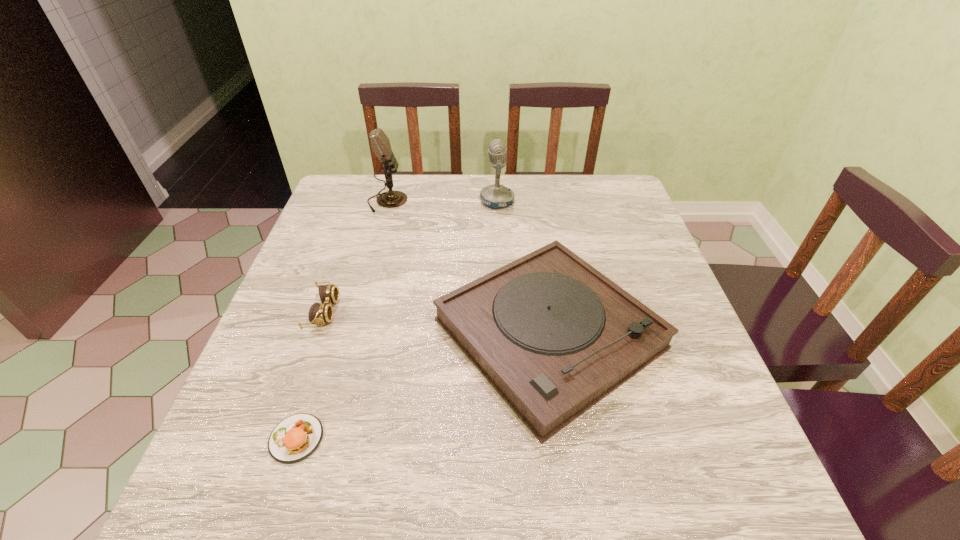
Where is `vacant space at the near edge of the desktop`? The width and height of the screenshot is (960, 540). vacant space at the near edge of the desktop is located at coordinates (403, 490).

This screenshot has width=960, height=540. I want to click on free space at the left edge, so click(x=368, y=245).

You are a GUI agent. You are given a task and a screenshot of the screen. Output one action in this format:
    pyautogui.click(x=<x>, y=<y>)
    Task: Click on the free space at the right edge of the desktop
    This screenshot has height=540, width=960.
    Given the screenshot: What is the action you would take?
    pyautogui.click(x=607, y=232)

I want to click on free region at the far left corner of the desktop, so click(350, 193).

Find the location of a particular element. vacant space at the near left corner of the desktop is located at coordinates (268, 480).

This screenshot has width=960, height=540. I want to click on blank space at the far right corner of the desktop, so click(618, 213).

Image resolution: width=960 pixels, height=540 pixels. What are the coordinates of `vacant space that's between the left microphone and the phonograph record` in the screenshot? It's located at (468, 268).

Find the location of `free space between the shortest object and the left microphone`. free space between the shortest object and the left microphone is located at coordinates (342, 320).

Where is `vacant area between the goggles and the right microphone`? vacant area between the goggles and the right microphone is located at coordinates (410, 256).

What are the coordinates of `free spot between the shortest object and the third shortest object` in the screenshot? It's located at (422, 386).